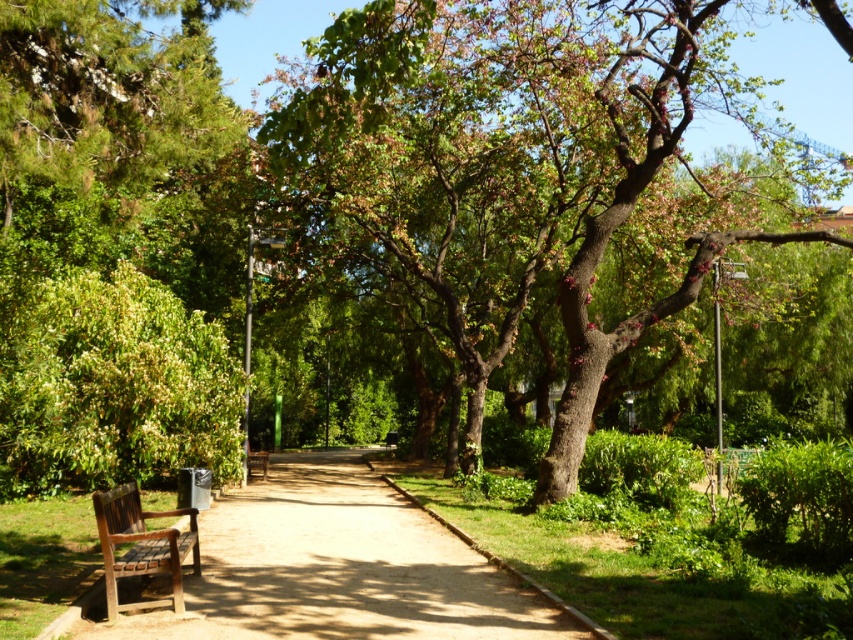
Does brown wooden pavement at lower left appear under brown wooden bench at center?

Actually, brown wooden pavement at lower left is above brown wooden bench at center.

Is point (332, 605) farther from viewer compared to point (248, 474)?

No.

The height and width of the screenshot is (640, 853). I want to click on brown wooden pavement at lower left, so click(338, 568).

Locate an element on the screen. brown wooden pavement at lower left is located at coordinates (338, 568).

Which is in front, point (479, 97) or point (111, 554)?

Point (111, 554) is in front.

Does point (769, 205) come farther from viewer compared to point (169, 602)?

Yes, point (769, 205) is farther from viewer.

This screenshot has width=853, height=640. Find the location of `green textured tree at center`. green textured tree at center is located at coordinates (527, 180).

Between green textured tree at center and brown wooden pavement at lower left, which one appears on the right side from the viewer's perspective?

From the viewer's perspective, green textured tree at center appears more on the right side.

Which is above, green textured tree at center or brown wooden pavement at lower left?

green textured tree at center is higher up.

Which is in front, point (297, 67) or point (253, 595)?

Point (253, 595)

Identify the location of green textured tree at center. [527, 180].